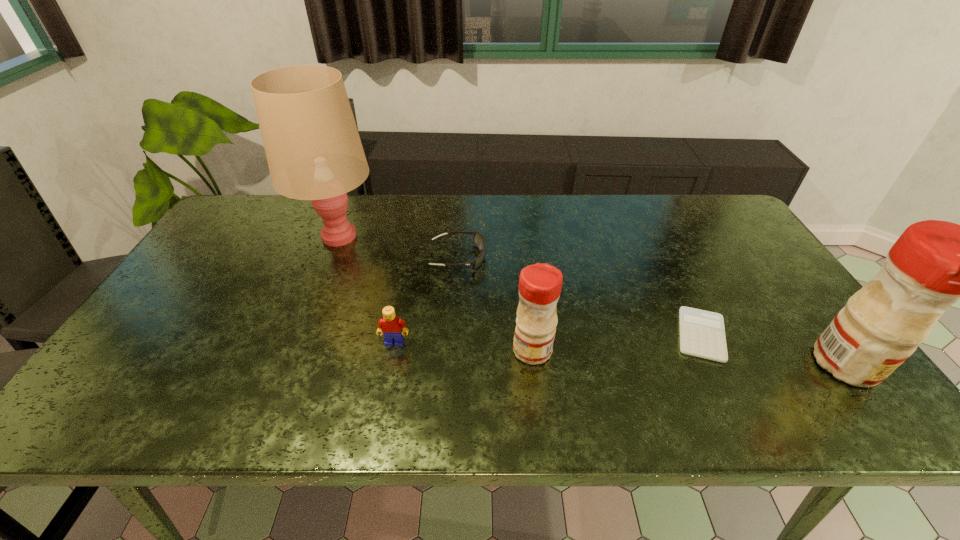
Identify the location of free space that satisfies the following two spatial constraints: 1. on the face of the fifth object from right to left; 2. on the left side of the rightmost object. (391, 364).

Where is `free spot that satisfies the following two spatial constraints: 1. on the lenses of the third tallest object; 2. on the right side of the third object from left to right`? The height and width of the screenshot is (540, 960). free spot that satisfies the following two spatial constraints: 1. on the lenses of the third tallest object; 2. on the right side of the third object from left to right is located at coordinates (452, 350).

You are a GUI agent. You are given a task and a screenshot of the screen. Output one action in this format:
    pyautogui.click(x=<x>, y=<y>)
    Task: Click on the vacant space that satisfies the following two spatial constraints: 1. on the face of the fifth object from right to left; 2. on the left side of the fourth shortest object
    This screenshot has height=540, width=960.
    Given the screenshot: What is the action you would take?
    pyautogui.click(x=394, y=350)